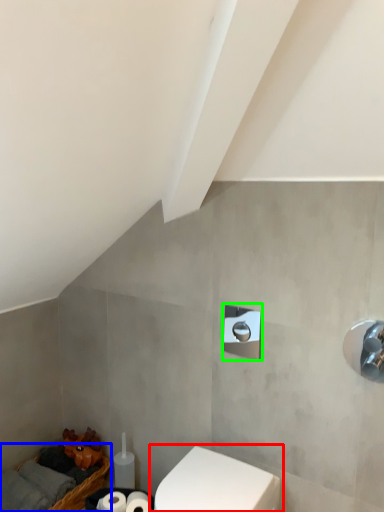
Question: Estimate the real-world distances between objects in this image. Which object is closer to toilet (highlighted by a red box), basket (highlighted by a blue box) or shower (highlighted by a green box)?

Choices:
 (A) basket
 (B) shower

Answer: (B)